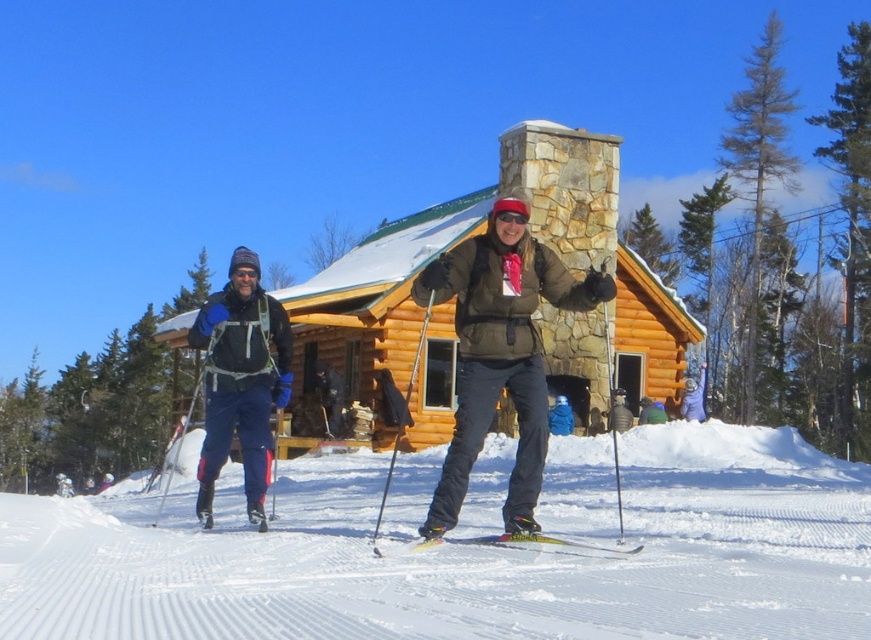
The height and width of the screenshot is (640, 871). I want to click on brown wooden log cabin at center, so click(544, 307).

Locate an element on the screen. brown wooden log cabin at center is located at coordinates (544, 307).

At what (x,y) coordinates should I click in order to perform the action: click on brown wooden log cabin at center. Please return your answer as a coordinate pair (x, y). This screenshot has height=640, width=871. Looking at the image, I should click on (544, 307).

Measure the distance between white powdery snow at center and yellow metallic ski at center.

22.97 feet

Does white powdery snow at center appear over yellow metallic ski at center?

No, white powdery snow at center is not above yellow metallic ski at center.

Is point (652, 493) positioned in front of point (545, 540)?

No, it is behind (545, 540).

I want to click on white powdery snow at center, so click(x=460, y=556).

Measure the distance from white powdery snow at center to brushed metal ski pole at left.

18.71 feet

Is point (495, 593) positioned after point (238, 326)?

No, (495, 593) is in front of (238, 326).

The width and height of the screenshot is (871, 640). Identify the location of white powdery snow at center. (460, 556).